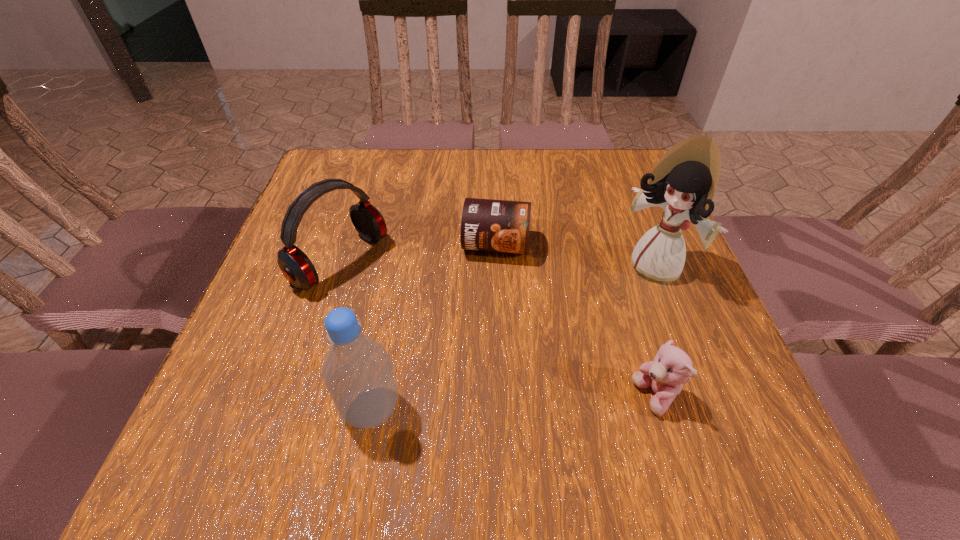
This screenshot has height=540, width=960. What are the coordinates of `bottle` in the screenshot? It's located at (357, 371).

The height and width of the screenshot is (540, 960). What are the coordinates of `teddy bear` in the screenshot? It's located at (671, 368).

Where is `can`? can is located at coordinates (491, 225).

I want to click on the third shortest object, so click(x=296, y=267).

Locate an element on the screen. The image size is (960, 540). doll is located at coordinates (x=683, y=182).

What are the coordinates of `vacant space located 0.220m on the back of the fourth shortest object` in the screenshot? It's located at (394, 288).

Locate an element on the screen. vacant region located 0.090m at the face of the teddy bear is located at coordinates (580, 397).

Locate an element on the screen. This screenshot has width=960, height=540. free region located 0.110m at the face of the teddy bear is located at coordinates (568, 397).

Locate an element on the screen. The image size is (960, 540). vacant area located 0.080m at the face of the teddy bear is located at coordinates (586, 397).

This screenshot has width=960, height=540. What are the coordinates of `free space located on the front label of the can` in the screenshot? It's located at (470, 420).